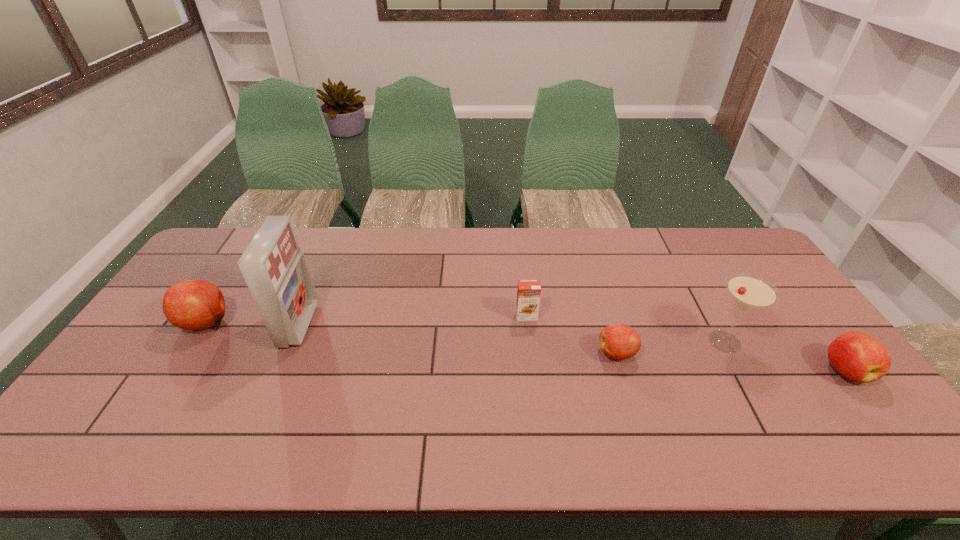
I want to click on the first-aid kit, so click(276, 272).

Find the location of a particular element. vacant space situated 0.270m on the right of the leftmost apple is located at coordinates (324, 322).

Locate an element on the screen. This screenshot has width=960, height=540. free space located on the back of the third object from right to left is located at coordinates 603,307.

Where is `vacant space positioned 0.060m on the back of the second tallest apple`? This screenshot has width=960, height=540. vacant space positioned 0.060m on the back of the second tallest apple is located at coordinates (818, 335).

Where is `free region located on the back of the third object from left to right`? Image resolution: width=960 pixels, height=540 pixels. free region located on the back of the third object from left to right is located at coordinates (520, 258).

Identify the location of vacant space located on the right of the second object from right to left. The width and height of the screenshot is (960, 540). (798, 342).

Image resolution: width=960 pixels, height=540 pixels. Identify the location of free space located 0.140m on the front-facing side of the fifth object from right to left. (359, 325).

Locate an element on the screen. The image size is (960, 540). object that is at the near edge is located at coordinates (859, 357).

Locate an element on the screen. object positioned at the left edge is located at coordinates coord(193,304).

This screenshot has width=960, height=540. What are the coordinates of `object that is at the right edge` in the screenshot? It's located at (859, 357).